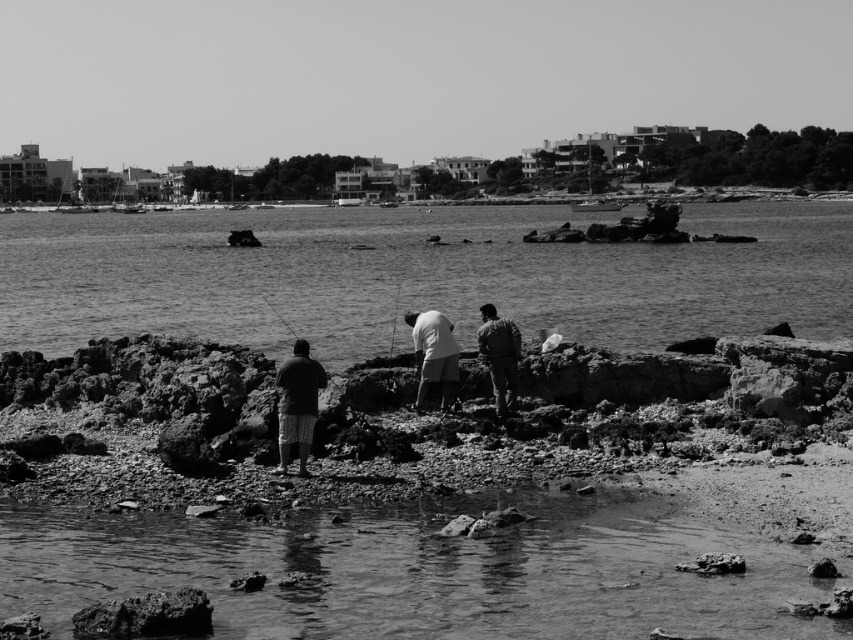
Question: Which object is the farthest from the smooth water at lower center?

Choices:
 (A) smooth white shirt at center
 (B) dark green fabric jacket at center
 (C) smooth plastic fishing pole at center

Answer: (C)

Question: Which point is closer to the camera?

Choices:
 (A) smooth white shirt at center
 (B) striped shorts at center
 (C) smooth plastic fishing pole at center
 (D) smooth water at center

Answer: (B)

Question: Does striped shorts at center appear on the right side of dark green fabric jacket at center?

Choices:
 (A) no
 (B) yes

Answer: (A)

Question: Which is nearer to the smooth water at lower center?

Choices:
 (A) striped shorts at center
 (B) smooth water at center
 (C) smooth plastic fishing pole at center

Answer: (A)

Question: Is smooth water at center below smooth water at lower center?

Choices:
 (A) yes
 (B) no

Answer: (B)

Question: Does smooth water at center have a smaller size compared to striped shorts at center?

Choices:
 (A) yes
 (B) no

Answer: (B)